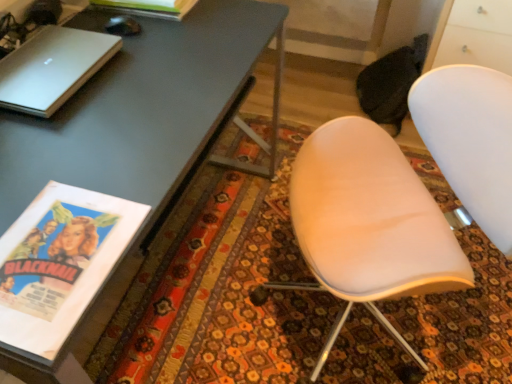
Find the location of a particular element. This screenshot has height=384, width=512. vacant space to the right of silver metallic laptop at upper left is located at coordinates (148, 81).